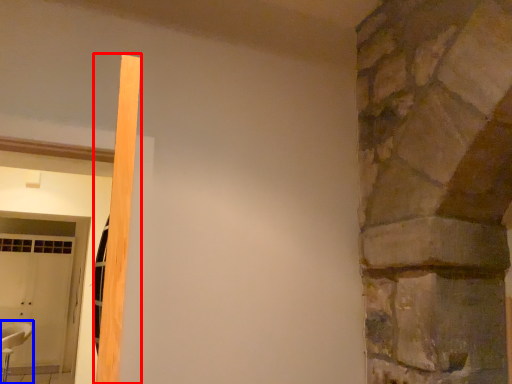
Question: Which object appears farthest to the camera in this image, beam (highlighted by a red box) or chair (highlighted by a blue box)?

Choices:
 (A) beam
 (B) chair

Answer: (B)